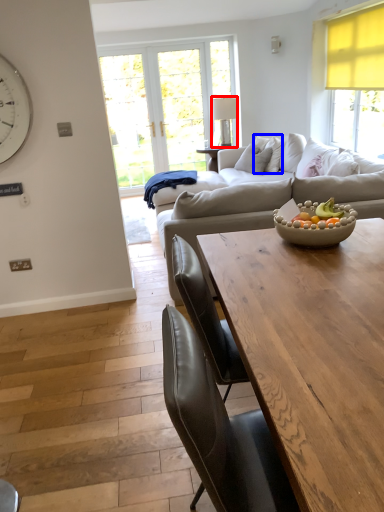
Question: Which object is further to the camera taking this photo, lamp (highlighted by a red box) or pillow (highlighted by a blue box)?

Choices:
 (A) lamp
 (B) pillow

Answer: (A)